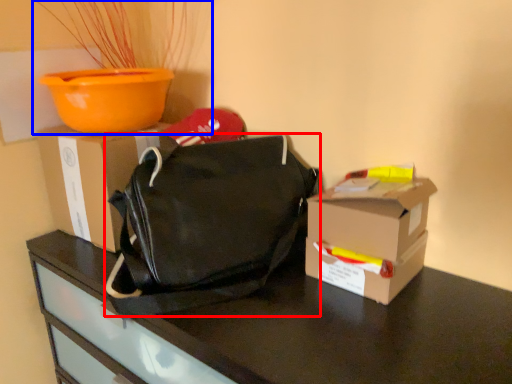
Question: Among these objects, which one is nearest to the camera, handbag (highlighted by a red box) or houseplant (highlighted by a blue box)?

Choices:
 (A) handbag
 (B) houseplant

Answer: (A)